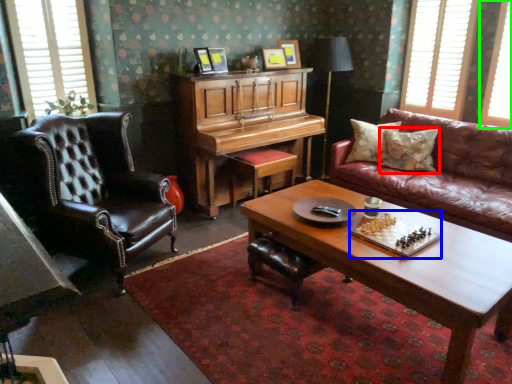
Question: Estimate the real-world distances between objects in this image. Which object is closer to pillow (highlighted by a red box), board game (highlighted by a blue box) or window (highlighted by a green box)?

Choices:
 (A) board game
 (B) window

Answer: (B)